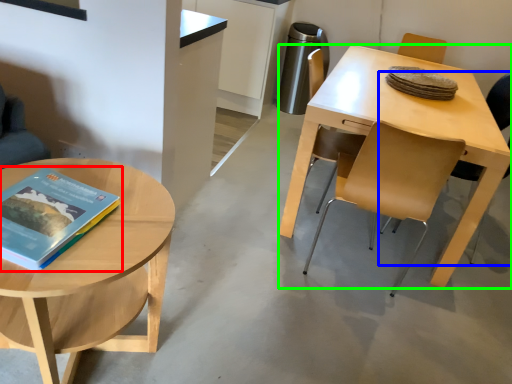
Question: Considering the real-world distances, which object is farthest from book (highlighted by a red box)? chair (highlighted by a blue box) or desk (highlighted by a green box)?

Choices:
 (A) chair
 (B) desk

Answer: (A)